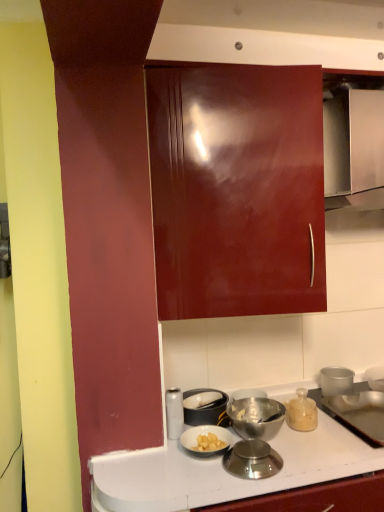
Question: Is metallic silver scale at lower center, the 1th kitchen appliance positioned from the front, not close to matte glass jar at lower right, placed as the third kitchen appliance when sorted from front to back?

Choices:
 (A) no
 (B) yes

Answer: (A)

Question: Does metallic silver scale at lower center, the second kitchen appliance positioned from the left, appear on the left side of matte glass jar at lower right, placed as the 1th kitchen appliance when sorted from back to front?

Choices:
 (A) yes
 (B) no

Answer: (A)

Question: Is metallic silver scale at lower center, which is the 3th kitchen appliance from back to front, taller than matte glass jar at lower right, placed as the third kitchen appliance when sorted from front to back?

Choices:
 (A) yes
 (B) no

Answer: (B)

Question: Considering the relative positions of metallic silver scale at lower center, the second kitchen appliance positioned from the left, and matte glass jar at lower right, placed as the third kitchen appliance when sorted from front to back, in the image provided, is metallic silver scale at lower center, the second kitchen appliance positioned from the left, in front of matte glass jar at lower right, placed as the third kitchen appliance when sorted from front to back,?

Choices:
 (A) no
 (B) yes

Answer: (B)

Question: Is metallic silver scale at lower center, the second kitchen appliance positioned from the left, to the right of matte glass jar at lower right, the 1th kitchen appliance when ordered from right to left, from the viewer's perspective?

Choices:
 (A) yes
 (B) no

Answer: (B)

Question: Does point (302, 431) appear closer or farther from the camera than point (269, 473)?

Choices:
 (A) closer
 (B) farther

Answer: (B)

Question: In terms of size, does matte glass jar at lower right, placed as the third kitchen appliance when sorted from front to back, appear bigger or smaller than metallic silver scale at lower center, which is the 3th kitchen appliance from back to front?

Choices:
 (A) big
 (B) small

Answer: (A)

Question: In the image, is matte glass jar at lower right, which ranks as the 3th kitchen appliance in left-to-right order, positioned in front of or behind metallic silver scale at lower center, the 1th kitchen appliance positioned from the front?

Choices:
 (A) front
 (B) behind

Answer: (B)

Question: Looking at their shapes, would you say matte glass jar at lower right, which ranks as the 3th kitchen appliance in left-to-right order, is wider or thinner than metallic silver scale at lower center, placed as the second kitchen appliance when sorted from right to left?

Choices:
 (A) thin
 (B) wide

Answer: (A)

Question: Which is correct: metallic silver drawer at upper right is inside white glossy canister at lower center, the 3th kitchen appliance in the right-to-left sequence, or outside of it?

Choices:
 (A) inside
 (B) outside

Answer: (B)

Question: From a real-world perspective, is metallic silver drawer at upper right positioned above or below white glossy canister at lower center, which is the 2th kitchen appliance in back-to-front order?

Choices:
 (A) below
 (B) above

Answer: (B)

Question: Considering their positions, is metallic silver drawer at upper right located in front of or behind white glossy canister at lower center, the 3th kitchen appliance in the right-to-left sequence?

Choices:
 (A) front
 (B) behind

Answer: (A)

Question: From the image's perspective, is metallic silver drawer at upper right above or below white glossy canister at lower center, the second kitchen appliance positioned from the front?

Choices:
 (A) below
 (B) above

Answer: (B)

Question: From the image's perspective, relative to metallic silver drawer at upper right, is white glossy canister at lower center, the 3th kitchen appliance in the right-to-left sequence, above or below?

Choices:
 (A) above
 (B) below

Answer: (B)

Question: Is white glossy canister at lower center, the 1th kitchen appliance from the left, bigger or smaller than metallic silver drawer at upper right?

Choices:
 (A) big
 (B) small

Answer: (B)